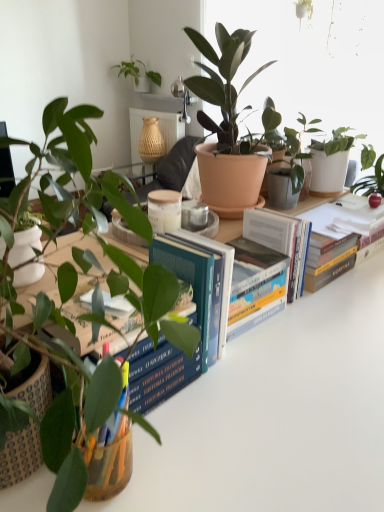
Question: Would you say blue hardcover book at center is inside or outside white glossy table at center?

Choices:
 (A) outside
 (B) inside

Answer: (A)

Question: From the image's perspective, relative to white glossy table at center, is blue hardcover book at center above or below?

Choices:
 (A) above
 (B) below

Answer: (A)

Question: From a real-world perspective, relative to white glossy table at center, is blue hardcover book at center vertically above or below?

Choices:
 (A) below
 (B) above

Answer: (B)

Question: Is white glossy table at center taller or shorter than blue hardcover book at center?

Choices:
 (A) short
 (B) tall

Answer: (B)

Question: Is white glossy table at center inside or outside of blue hardcover book at center?

Choices:
 (A) inside
 (B) outside

Answer: (B)

Question: Relative to blue hardcover book at center, is white glossy table at center in front or behind?

Choices:
 (A) behind
 (B) front

Answer: (B)

Question: Considering the positions of white glossy table at center and blue hardcover book at center in the image, is white glossy table at center wider or thinner than blue hardcover book at center?

Choices:
 (A) wide
 (B) thin

Answer: (A)